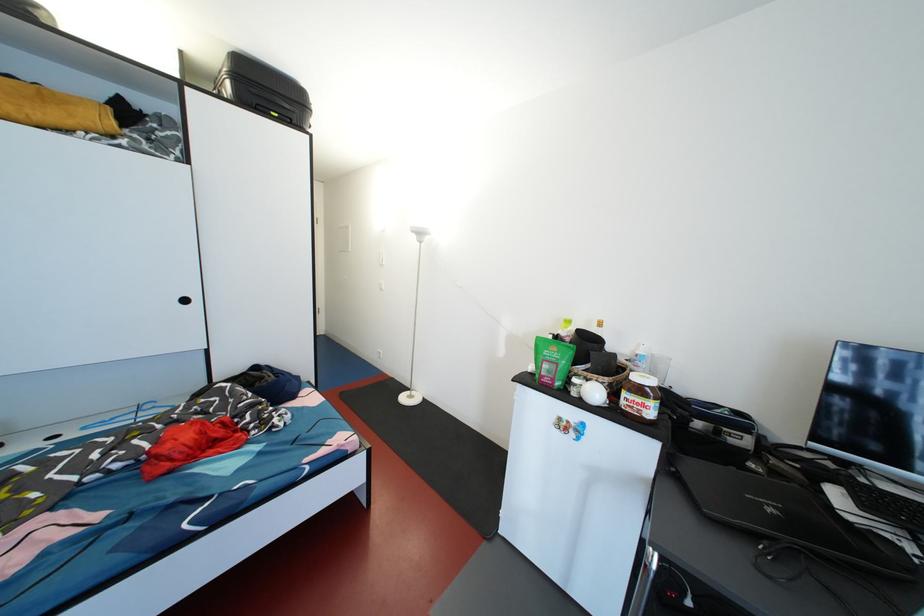
The height and width of the screenshot is (616, 924). In order to click on plastic water bottle in this screenshot , I will do `click(639, 358)`.